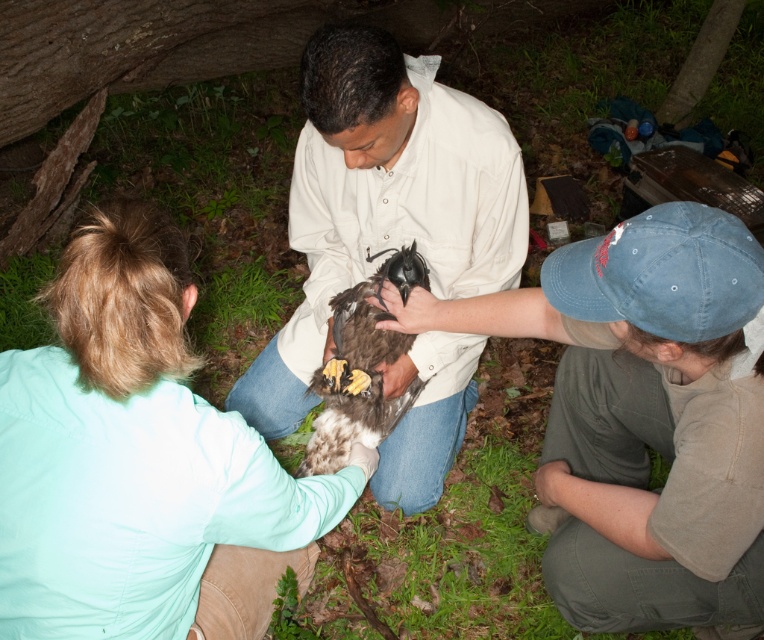
Question: Is light blue shirt at center to the left of smooth beige shirt at center from the viewer's perspective?

Choices:
 (A) no
 (B) yes

Answer: (B)

Question: Among these points, which one is farthest from the camera?

Choices:
 (A) (173, 292)
 (B) (746, 266)
 (C) (306, 403)

Answer: (C)

Question: Which point appears farthest from the camera in this image?

Choices:
 (A) (334, 355)
 (B) (688, 308)
 (C) (379, 113)

Answer: (A)

Question: Where is brown feathered hawk at center located in relation to smooth beige shirt at center in the image?

Choices:
 (A) right
 (B) left

Answer: (A)

Question: Does smooth beige shirt at center appear on the left side of brown speckled feathers at center?

Choices:
 (A) yes
 (B) no

Answer: (A)

Question: Which point is farther from the camera taking this photo?

Choices:
 (A) (334, 362)
 (B) (452, 109)
 (C) (716, 564)

Answer: (A)